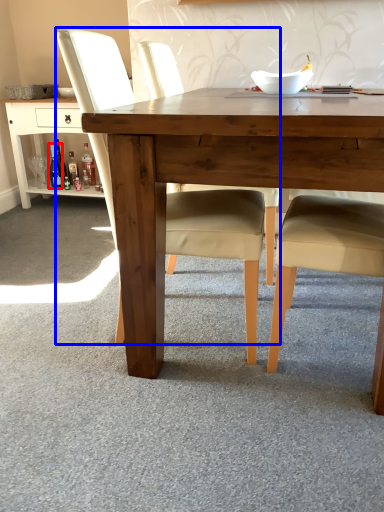
Question: Which of the following is the farthest to the observer, bottle (highlighted by a red box) or chair (highlighted by a blue box)?

Choices:
 (A) bottle
 (B) chair

Answer: (A)